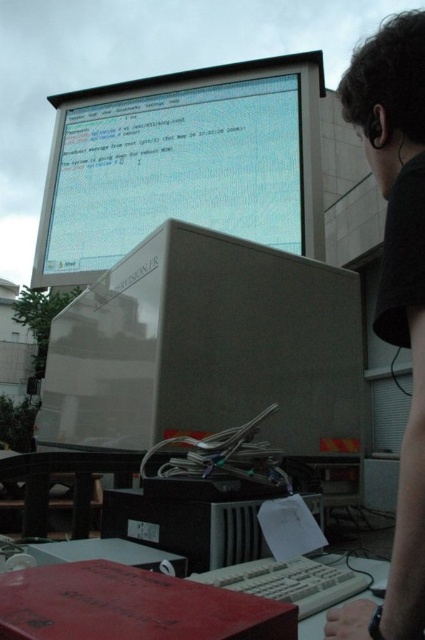
Question: Can you confirm if satin white monitor at center is positioned to the right of black matte shirt at upper right?

Choices:
 (A) no
 (B) yes

Answer: (A)

Question: From the image, what is the correct spatial relationship of satin white monitor at center in relation to matte gray monitor at upper center?

Choices:
 (A) above
 (B) below

Answer: (B)

Question: Which of the following is the closest to the observer?

Choices:
 (A) (218, 154)
 (B) (413, 292)

Answer: (B)

Question: Which point is closer to the camera?

Choices:
 (A) tap(345, 321)
 (B) tap(320, 218)
 (C) tap(410, 586)

Answer: (C)

Question: Considering the real-world distances, which object is closest to the matte gray monitor at upper center?

Choices:
 (A) satin white monitor at center
 (B) black matte shirt at upper right

Answer: (A)

Question: From the image, what is the correct spatial relationship of matte gray monitor at upper center in relation to black matte shirt at upper right?

Choices:
 (A) right
 (B) left

Answer: (B)